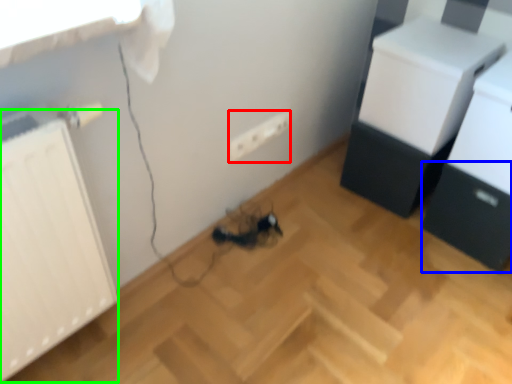
Question: Based on their relative distances, which object is farther from electric outlet (highlighted by a red box)? Choose from drawer (highlighted by a blue box) and radiator (highlighted by a green box).

Choices:
 (A) drawer
 (B) radiator

Answer: (A)